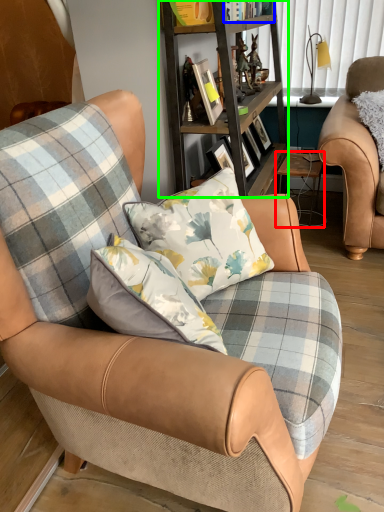
Question: Considering the real-world distances, which object is closest to table (highlighted by a red box)? book (highlighted by a blue box) or shelf (highlighted by a green box).

Choices:
 (A) book
 (B) shelf

Answer: (B)